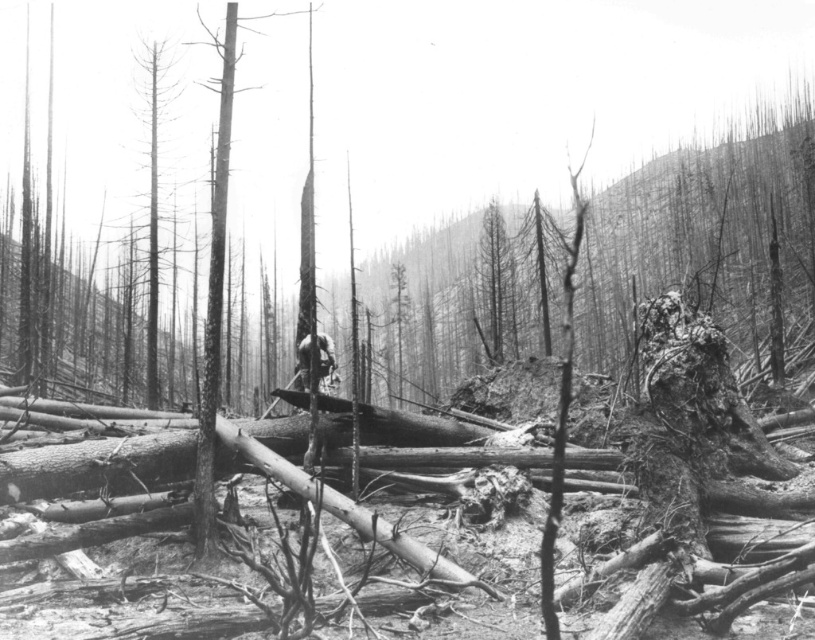
Question: Which of the following is the farthest from the observer?

Choices:
 (A) (304, 378)
 (B) (153, 67)

Answer: (B)

Question: Is charred wood tree at center to the left of dark gray wood at center from the viewer's perspective?

Choices:
 (A) no
 (B) yes

Answer: (A)

Question: Which of these objects is positioned closest to the dead wood trunk at left?

Choices:
 (A) charred wood tree at center
 (B) dark gray wood at center

Answer: (A)

Question: Can you confirm if dead wood trunk at left is wider than dark gray wood at center?

Choices:
 (A) yes
 (B) no

Answer: (A)

Question: Is dead wood trunk at left bigger than dark gray wood at center?

Choices:
 (A) yes
 (B) no

Answer: (A)

Question: Among these objects, which one is nearest to the camera?

Choices:
 (A) dark gray wood at center
 (B) charred wood tree at center

Answer: (A)